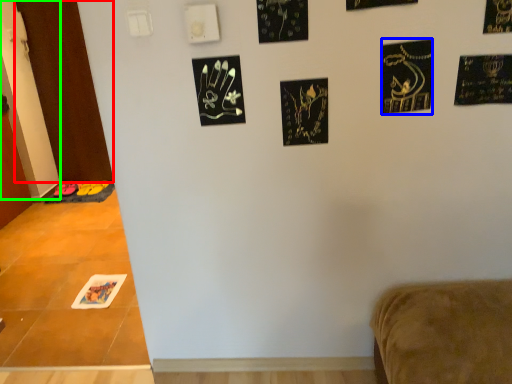
Question: Estimate the real-world distances between objects in this image. Which object is farther from door (highlighted by a red box), print (highlighted by a blue box) or door (highlighted by a green box)?

Choices:
 (A) print
 (B) door

Answer: (A)